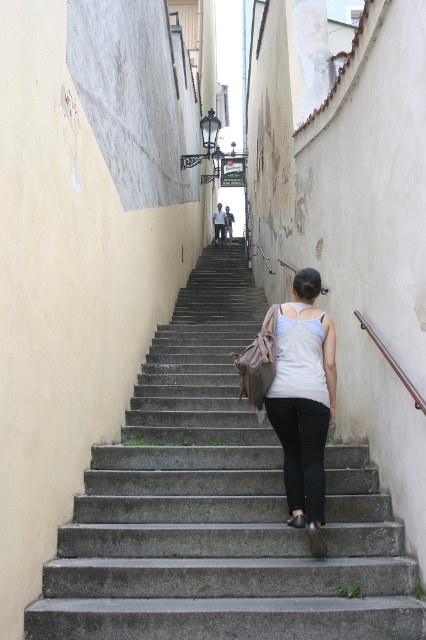
You are standing at the bottom of the gray concrete stairs at center and want to take a photo of the streetlamp mounted on the left wall near the top. The camera you are using has a maximum zoom range of 5 meters. Can you capture the streetlamp in your photo without moving closer?

The gray concrete stairs at center and camera are 3.66 meters apart from each other, so yes, the camera can capture the streetlamp in the photo since the distance is within the 5 meter zoom range.

You are a painter standing at the bottom of the gray concrete stairs at center. You need to paint the white matte tank top at center. Can you reach it without climbing the stairs?

The gray concrete stairs at center is not as tall as white matte tank top at center, so the tank top is higher up. Since you are at the bottom of the stairs, you cannot reach the white matte tank top at center without climbing the stairs.